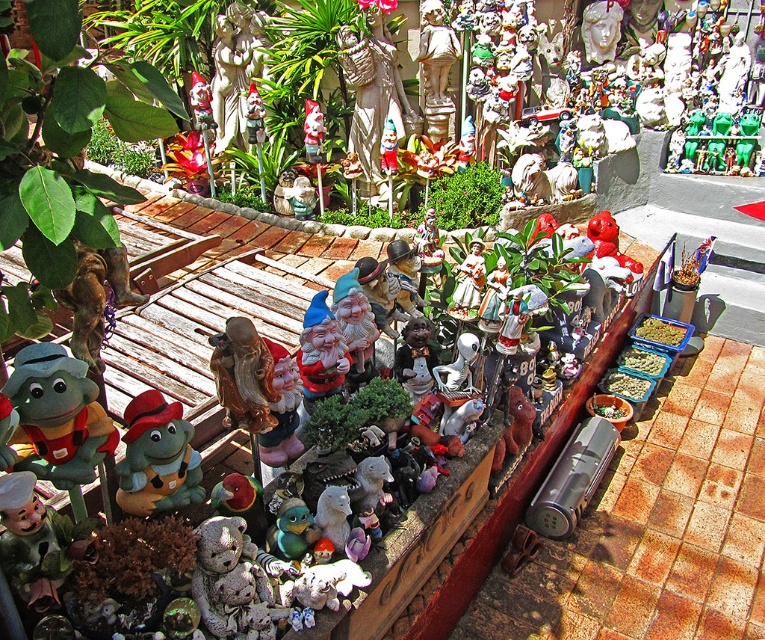
You are a visitor in the garden and want to take a photo of both the green plush frog at left and the plush green toy at center. Which one should you focus on first if you want to capture both in the same frame without moving the camera?

You should focus on the plush green toy at center first because the green plush frog at left is located above it, so adjusting the camera angle to include both would require framing from the lower object upwards.

You are a gardener trying to place a new decorative item on the shelf. You have a small statue that is 30 cm wide. The green plush frog at left and the plush green toy at center are already on the shelf. Which of these two existing items has a larger width?

The green plush frog at left has a larger width than the plush green toy at center.